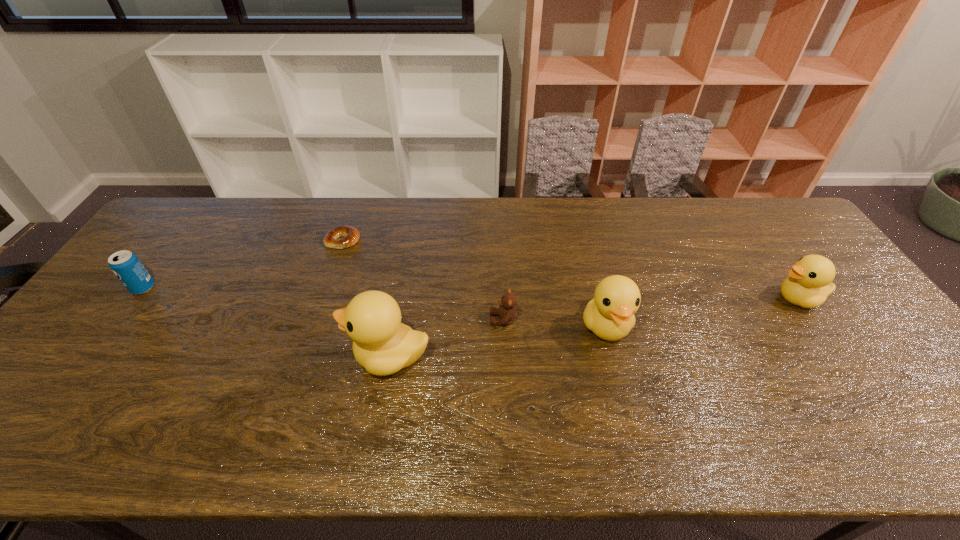
I want to click on the fourth closest object to the leftmost object, so click(610, 314).

Where is `the second closest duck relative to the shortest object`? The image size is (960, 540). the second closest duck relative to the shortest object is located at coordinates [610, 314].

The image size is (960, 540). I want to click on the closest duck to the bagel, so click(383, 345).

This screenshot has width=960, height=540. I want to click on vacant space that satisfies the following two spatial constraints: 1. on the face of the shortest duck; 2. on the face of the second tallest duck, so click(x=817, y=326).

You are a GUI agent. You are given a task and a screenshot of the screen. Output one action in this format:
    pyautogui.click(x=<x>, y=<y>)
    Task: Click on the blank area in the image that satisfies the following two spatial constraints: 1. on the face of the second tallest duck; 2. on the face of the leftmost duck
    The height and width of the screenshot is (540, 960).
    Given the screenshot: What is the action you would take?
    pyautogui.click(x=613, y=356)

At what (x,y) coordinates should I click in order to perform the action: click on vacant space that satisfies the following two spatial constraints: 1. on the face of the rightmost duck; 2. on the face of the second shortest duck. Please return your answer as a coordinate pair (x, y). Looking at the image, I should click on (817, 326).

I want to click on blank space that satisfies the following two spatial constraints: 1. on the face of the rightmost object; 2. on the face of the second shortest duck, so click(x=817, y=326).